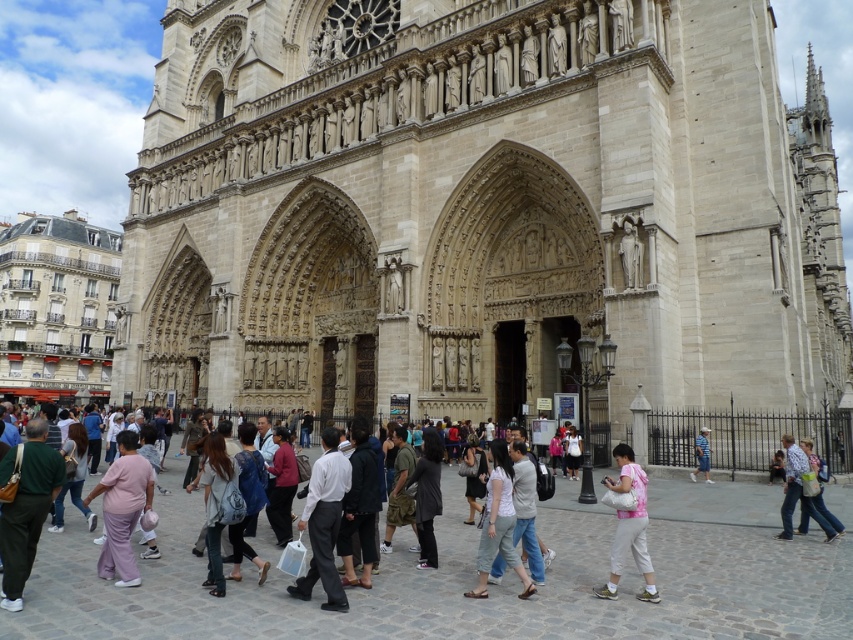
How much distance is there between beige stone church at center and dark gray fabric dress at center?

A distance of 151.46 feet exists between beige stone church at center and dark gray fabric dress at center.

Which of these two, beige stone church at center or dark gray fabric dress at center, stands taller?

Standing taller between the two is beige stone church at center.

Is point (717, 67) farther from camera compared to point (468, 481)?

Yes, it is behind point (468, 481).

Locate an element on the screen. The image size is (853, 640). beige stone church at center is located at coordinates (479, 209).

Which of these two, light gray stone building at left or dark gray fabric dress at center, stands shorter?

dark gray fabric dress at center

Can you confirm if light gray stone building at left is shorter than dark gray fabric dress at center?

Incorrect, light gray stone building at left's height does not fall short of dark gray fabric dress at center's.

Which is in front, point (57, 353) or point (473, 508)?

Positioned in front is point (473, 508).

Locate an element on the screen. light gray stone building at left is located at coordinates (56, 307).

Who is taller, dark gray fabric dress at center or blue denim jeans at lower right?

dark gray fabric dress at center

Is point (468, 435) positioned after point (699, 456)?

Yes, it is behind point (699, 456).

You are a GUI agent. You are given a task and a screenshot of the screen. Output one action in this format:
    pyautogui.click(x=<x>, y=<y>)
    Task: Click on the dark gray fabric dress at center
    
    Given the screenshot: What is the action you would take?
    pyautogui.click(x=473, y=476)